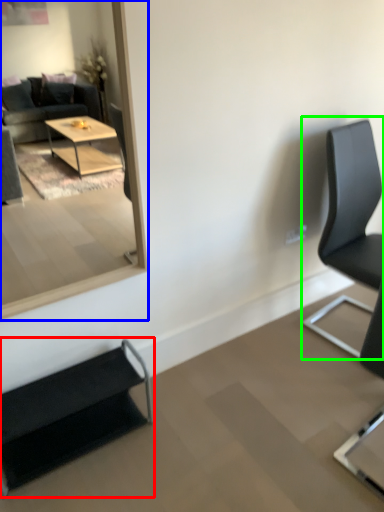
Question: Which is farther away from chair (highlighted by a red box)? mirror (highlighted by a blue box) or chair (highlighted by a green box)?

Choices:
 (A) mirror
 (B) chair

Answer: (A)